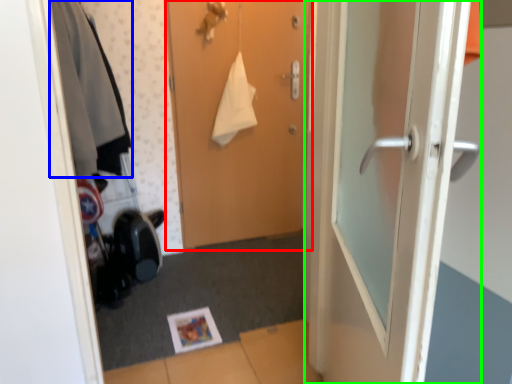
Question: Which object is positioned closest to door (highlighted by a red box)? Select from clothing (highlighted by a blue box) and door (highlighted by a green box).

Choices:
 (A) clothing
 (B) door

Answer: (A)